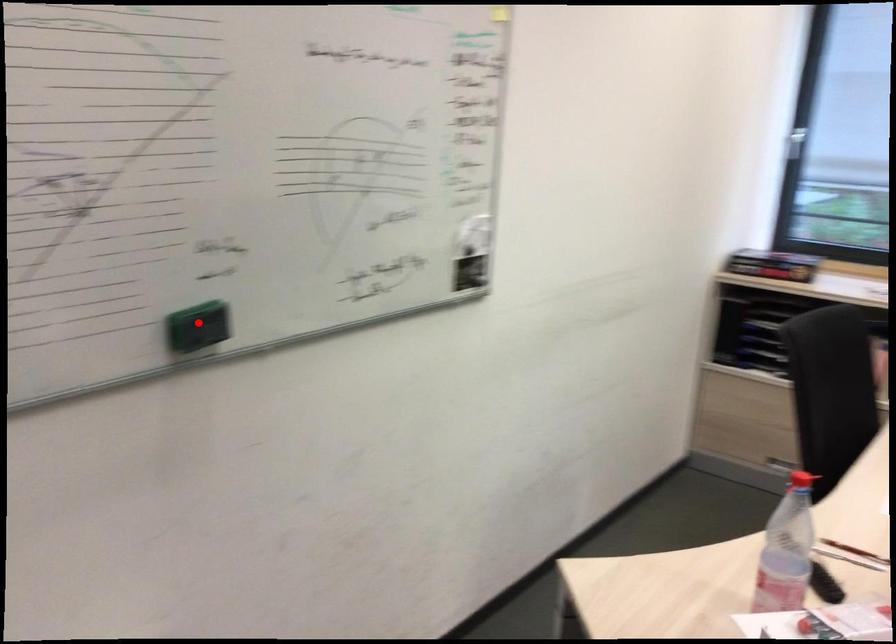
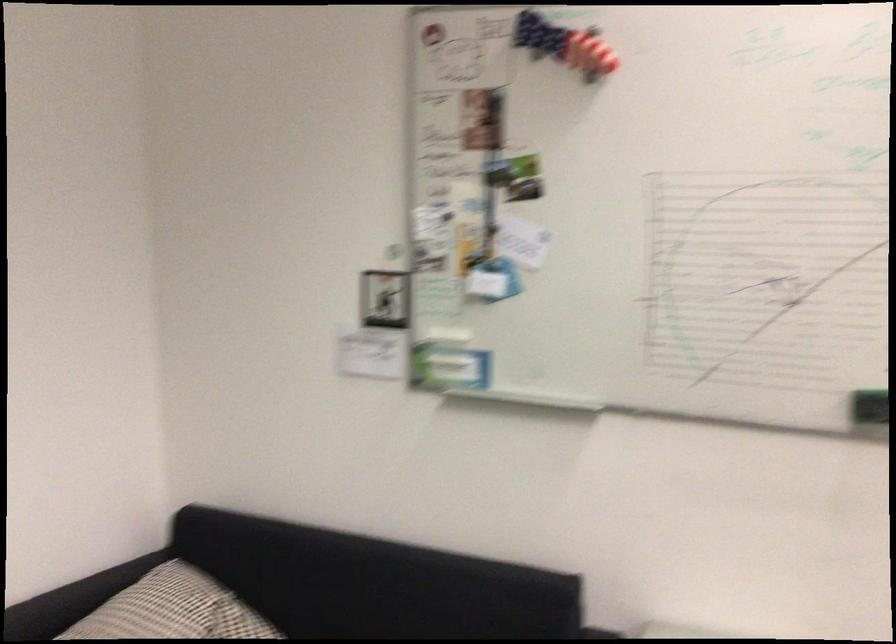
Question: I am providing you with two images of the same scene from different viewpoints. A red point is marked on the first image. Can you still see the location of the red point in image 2?

Choices:
 (A) Yes
 (B) No

Answer: (A)